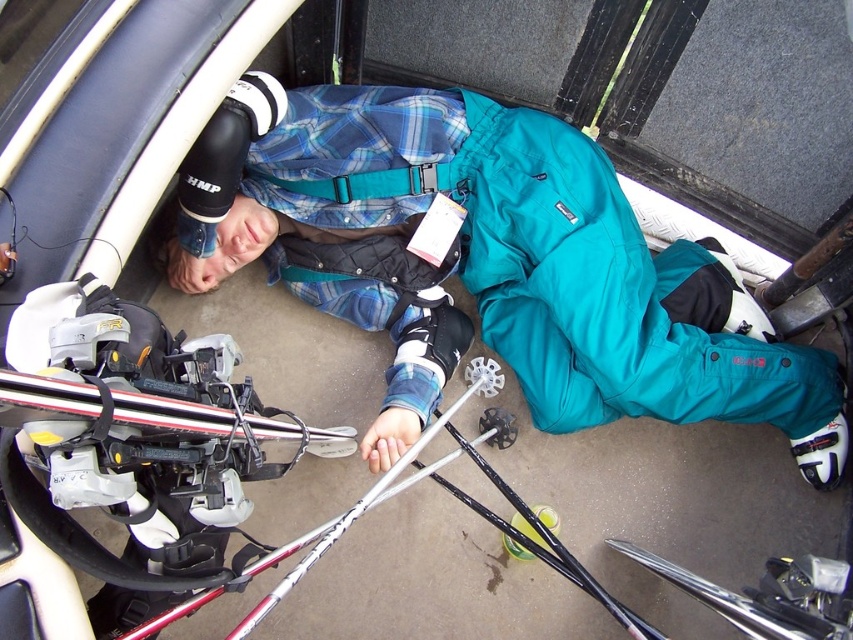
Between teal waterproof suit at center and teal fabric strap at center, which one appears on the left side from the viewer's perspective?

Positioned to the left is teal fabric strap at center.

Who is more distant from viewer, (x=497, y=237) or (x=389, y=172)?

The point (x=497, y=237) is behind.

Does point (558, 172) come in front of point (403, 186)?

Yes, it is.

I want to click on teal waterproof suit at center, so click(x=512, y=257).